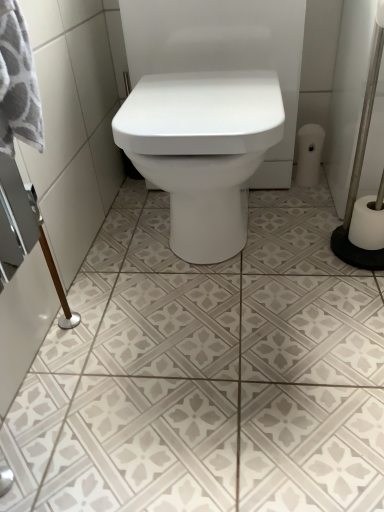
The width and height of the screenshot is (384, 512). What are the coordinates of `white textured tile at center` in the screenshot? It's located at (207, 373).

The image size is (384, 512). What do you see at coordinates (309, 154) in the screenshot? I see `white matte toilet paper at right, which is the second toilet paper from bottom to top` at bounding box center [309, 154].

Identify the location of white textured tile at center. (207, 373).

Is white matte toilet paper at right, the second toilet paper from the top, located within white matte toilet paper at right, the 1th toilet paper positioned from the left?

No, white matte toilet paper at right, the second toilet paper from the top, is located outside of white matte toilet paper at right, the 1th toilet paper positioned from the left.

Considering the sizes of objects white matte toilet paper at right, which is counted as the 1th toilet paper, starting from the top, and white matte toilet paper at right, which is the 1th toilet paper from front to back, in the image provided, who is shorter, white matte toilet paper at right, which is counted as the 1th toilet paper, starting from the top, or white matte toilet paper at right, which is the 1th toilet paper from front to back,?

white matte toilet paper at right, which is the 1th toilet paper from front to back, is shorter.

In the image, is white matte toilet paper at right, which is counted as the 1th toilet paper, starting from the top, positioned in front of or behind white matte toilet paper at right, placed as the 1th toilet paper when sorted from right to left?

white matte toilet paper at right, which is counted as the 1th toilet paper, starting from the top, is positioned farther from the viewer than white matte toilet paper at right, placed as the 1th toilet paper when sorted from right to left.

Is white textured tile at center wider than white matte toilet paper at right, which is the second toilet paper from bottom to top?

Yes, white textured tile at center is wider than white matte toilet paper at right, which is the second toilet paper from bottom to top.

Between point (304, 490) and point (295, 181), which one is positioned behind?

Positioned behind is point (295, 181).

Does white textured tile at center turn towards white matte toilet paper at right, the second toilet paper positioned from the front?

No, white textured tile at center is not facing towards white matte toilet paper at right, the second toilet paper positioned from the front.

Starting from the white textured tile at center, which toilet paper is the 2nd one to the right? Please provide its 2D coordinates.

[(367, 223)]

Is the surface of white matte toilet paper at right, which is the 1th toilet paper from front to back, in direct contact with white textured tile at center?

No, white matte toilet paper at right, which is the 1th toilet paper from front to back, is not making contact with white textured tile at center.

Is white matte toilet paper at right, which is counted as the 2th toilet paper, starting from the left, aimed at white textured tile at center?

No, white matte toilet paper at right, which is counted as the 2th toilet paper, starting from the left, is not oriented towards white textured tile at center.

Is point (361, 216) farther from camera compared to point (306, 151)?

That is False.

Who is smaller, white matte toilet paper at right, placed as the 1th toilet paper when sorted from right to left, or white matte toilet paper at right, which is counted as the 1th toilet paper, starting from the top?

white matte toilet paper at right, placed as the 1th toilet paper when sorted from right to left, is smaller.

From the image's perspective, is white matte toilet paper at right, which is counted as the 2th toilet paper, starting from the left, located above or below white matte toilet paper at right, the 1th toilet paper positioned from the left?

From the image's perspective, white matte toilet paper at right, which is counted as the 2th toilet paper, starting from the left, appears below white matte toilet paper at right, the 1th toilet paper positioned from the left.

Considering the sizes of objects white matte toilet paper at right, which is the 1th toilet paper from front to back, and white matte toilet paper at right, which is counted as the 1th toilet paper, starting from the top, in the image provided, who is wider, white matte toilet paper at right, which is the 1th toilet paper from front to back, or white matte toilet paper at right, which is counted as the 1th toilet paper, starting from the top,?

white matte toilet paper at right, which is the 1th toilet paper from front to back.

Is white textured tile at center facing towards white matte toilet paper at right, acting as the 2th toilet paper starting from the back?

No, white textured tile at center is not oriented towards white matte toilet paper at right, acting as the 2th toilet paper starting from the back.

Considering the relative positions of white textured tile at center and white matte toilet paper at right, placed as the 1th toilet paper when sorted from right to left, in the image provided, is white textured tile at center in front of white matte toilet paper at right, placed as the 1th toilet paper when sorted from right to left,?

Yes, it is.

What's the angular difference between white textured tile at center and white matte toilet paper at right, acting as the 2th toilet paper starting from the back,'s facing directions?

There is a 0.192-degree angle between the facing directions of white textured tile at center and white matte toilet paper at right, acting as the 2th toilet paper starting from the back.

Is white textured tile at center not within white matte toilet paper at right, acting as the 2th toilet paper starting from the back?

Yes.

In the scene shown: Do you think white matte toilet paper at right, the 1th toilet paper positioned from the left, is within white textured tile at center, or outside of it?

The correct answer is: outside.

How different are the orientations of white matte toilet paper at right, which ranks as the 1th toilet paper in back-to-front order, and white textured tile at center in degrees?

The angular difference between white matte toilet paper at right, which ranks as the 1th toilet paper in back-to-front order, and white textured tile at center is 2.09 degrees.

Does white matte toilet paper at right, marked as the second toilet paper in a right-to-left arrangement, have a smaller size compared to white textured tile at center?

Yes, white matte toilet paper at right, marked as the second toilet paper in a right-to-left arrangement, is smaller than white textured tile at center.

Does point (307, 136) appear closer or farther from the camera than point (77, 408)?

Point (307, 136) is positioned farther from the camera compared to point (77, 408).

You are a GUI agent. You are given a task and a screenshot of the screen. Output one action in this format:
    pyautogui.click(x=<x>, y=<y>)
    Task: Click on the toilet paper that appears below the white matte toilet paper at right, which is the second toilet paper from bottom to top (from a real-world perspective)
    This screenshot has width=384, height=512.
    Given the screenshot: What is the action you would take?
    pyautogui.click(x=367, y=223)

I want to click on the 2nd toilet paper positioned above the white textured tile at center (from the image's perspective), so click(309, 154).

Which object lies further to the anchor point white textured tile at center, white matte toilet paper at right, the 1th toilet paper positioned from the left, or white matte toilet paper at right, which is the 1th toilet paper from front to back?

The object further to white textured tile at center is white matte toilet paper at right, the 1th toilet paper positioned from the left.

Based on the photo, looking at the image, which one is located further to white matte toilet paper at right, the second toilet paper positioned from the front, white textured tile at center or white matte toilet paper at right, acting as the 2th toilet paper starting from the back?

white textured tile at center is positioned further to the anchor white matte toilet paper at right, the second toilet paper positioned from the front.

Based on their spatial positions, is white matte toilet paper at right, the second toilet paper from the top, or white textured tile at center closer to white matte toilet paper at right, which is the second toilet paper from bottom to top?

white matte toilet paper at right, the second toilet paper from the top.

When comparing their distances from white matte toilet paper at right, the second toilet paper from the top, does white textured tile at center or white matte toilet paper at right, which ranks as the 1th toilet paper in back-to-front order, seem further?

white textured tile at center lies further to white matte toilet paper at right, the second toilet paper from the top, than the other object.

From the image, which object appears to be farther from white textured tile at center, white matte toilet paper at right, acting as the 2th toilet paper starting from the back, or white matte toilet paper at right, which is the second toilet paper from bottom to top?

The object further to white textured tile at center is white matte toilet paper at right, which is the second toilet paper from bottom to top.

Based on their spatial positions, is white matte toilet paper at right, which is the second toilet paper from bottom to top, or white textured tile at center closer to white matte toilet paper at right, which is counted as the 2th toilet paper, starting from the left?

white matte toilet paper at right, which is the second toilet paper from bottom to top, lies closer to white matte toilet paper at right, which is counted as the 2th toilet paper, starting from the left, than the other object.

Locate an element on the screen. The width and height of the screenshot is (384, 512). toilet paper positioned between white textured tile at center and white matte toilet paper at right, which is the second toilet paper from bottom to top, from near to far is located at coordinates (367, 223).